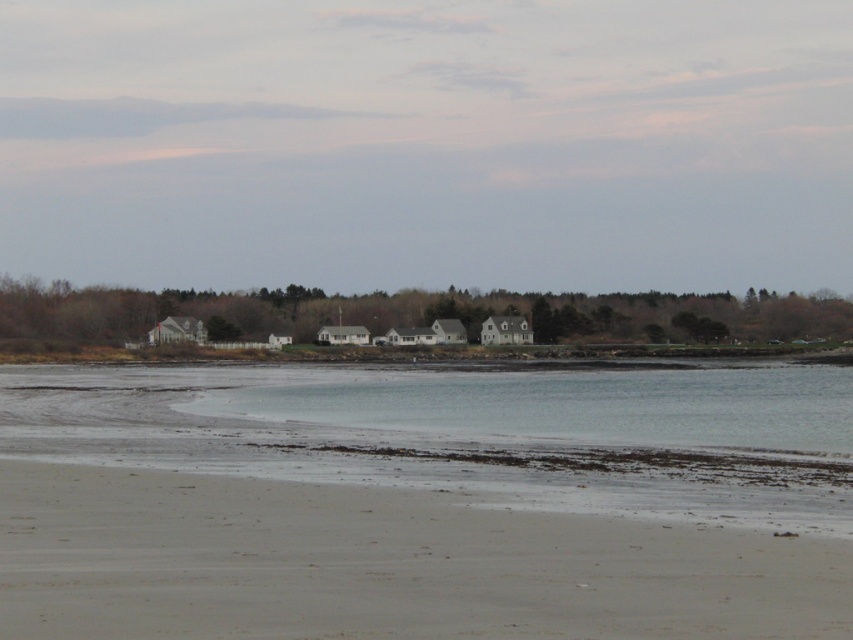
You are standing on the sandy beach at lower left and want to reach the clear water at lower center. Based on the scene, which direction should you move to get to the water?

You should move downward towards the clear water at lower center because the sandy beach at lower left is located above it, so going down the slope from the sandy beach at lower left will lead you to the clear water at lower center.